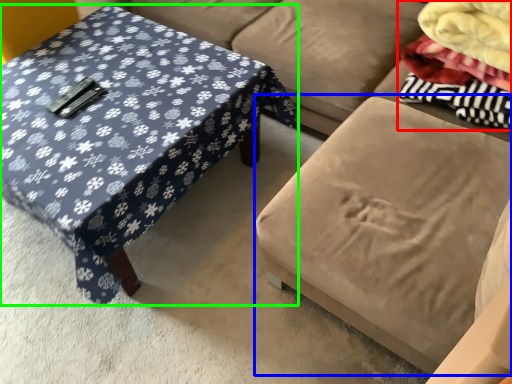
Question: Estimate the real-world distances between objects in this image. Which object is closer to fabric (highlighted by a red box), swivel chair (highlighted by a blue box) or coffee table (highlighted by a green box)?

Choices:
 (A) swivel chair
 (B) coffee table

Answer: (A)